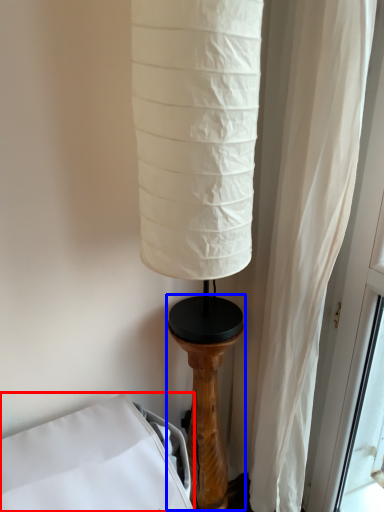
Question: Which of the following is the closest to the observer, furniture (highlighted by a red box) or pillar (highlighted by a blue box)?

Choices:
 (A) furniture
 (B) pillar

Answer: (A)